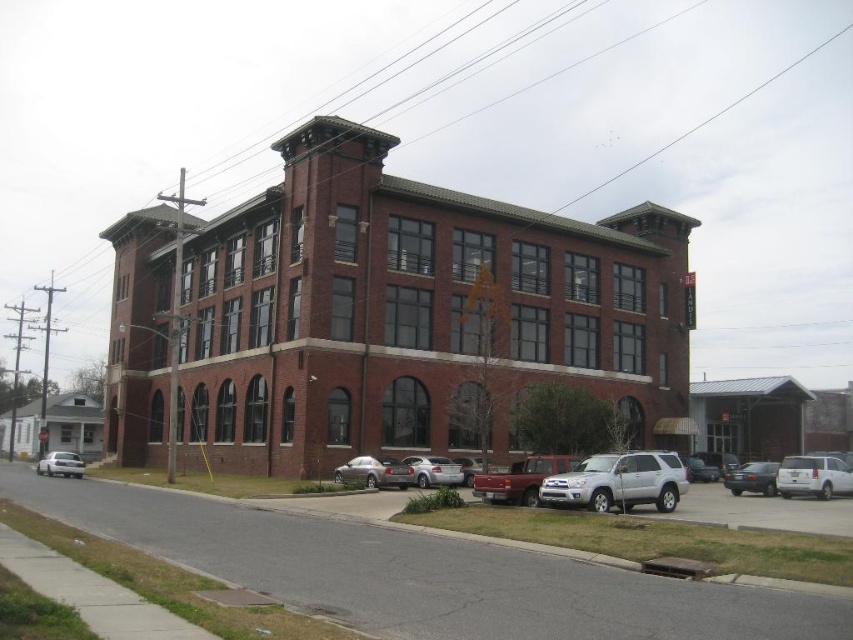
Question: Which object is farther from the camera taking this photo?

Choices:
 (A) metallic gray sedan at lower right
 (B) white matte sedan at lower left

Answer: (B)

Question: From the image, what is the correct spatial relationship of metallic gray sedan at lower right in relation to white matte sedan at lower left?

Choices:
 (A) above
 (B) below

Answer: (A)

Question: Which of the following is the closest to the observer?

Choices:
 (A) (54, 467)
 (B) (746, 470)

Answer: (B)

Question: Is metallic gray sedan at lower right closer to the viewer compared to white matte sedan at lower left?

Choices:
 (A) no
 (B) yes

Answer: (B)

Question: Is metallic gray sedan at lower right positioned behind white matte sedan at lower left?

Choices:
 (A) no
 (B) yes

Answer: (A)

Question: Among these objects, which one is nearest to the camera?

Choices:
 (A) metallic gray sedan at lower right
 (B) white matte sedan at lower left

Answer: (A)